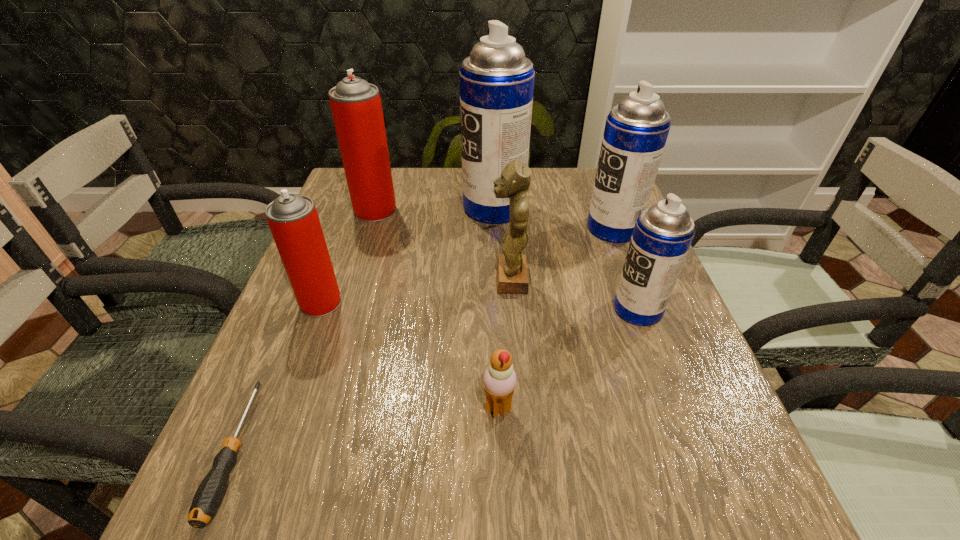
Find the location of a particular element. vacant region located 0.110m on the label side of the tallest aerosol can is located at coordinates (422, 207).

You are a GUI agent. You are given a task and a screenshot of the screen. Output one action in this format:
    pyautogui.click(x=<x>, y=<y>)
    Task: Click on the free space located on the label side of the tallest aerosol can
    
    Given the screenshot: What is the action you would take?
    pyautogui.click(x=441, y=207)

I want to click on vacant space located on the back of the farther red aerosol can, so click(x=385, y=179).

At what (x,y) coordinates should I click in order to perform the action: click on free space located 0.370m on the label side of the second biggest blue aerosol can. Please return your answer as a coordinate pair (x, y). The image size is (960, 540). Looking at the image, I should click on (442, 228).

Locate an element on the screen. free region located on the label side of the second biggest blue aerosol can is located at coordinates tap(489, 228).

The height and width of the screenshot is (540, 960). Find the location of `vacant space located 0.260m on the label side of the second biggest blue aerosol can`. vacant space located 0.260m on the label side of the second biggest blue aerosol can is located at coordinates (485, 228).

This screenshot has height=540, width=960. I want to click on vacant space located on the front-facing side of the figurine, so click(378, 279).

Locate an element on the screen. blank space located 0.190m on the front-facing side of the figurine is located at coordinates tap(406, 279).

The image size is (960, 540). Identify the location of vacant space located 0.190m on the front-facing side of the figurine. (406, 279).

The image size is (960, 540). What are the coordinates of `vacant position located on the label side of the nearest blue aerosol can` in the screenshot? It's located at (585, 309).